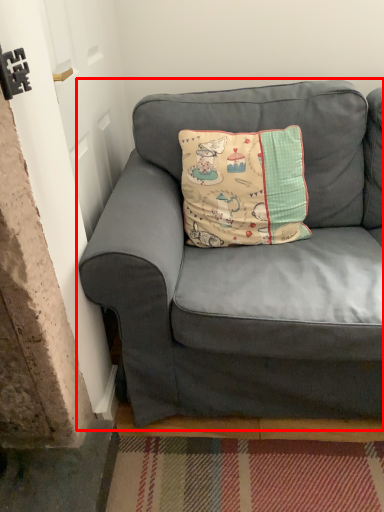
Question: From the image's perspective, what is the correct spatial positioning of studio couch (annotated by the red box) in reference to pillow?

Choices:
 (A) below
 (B) above

Answer: (A)